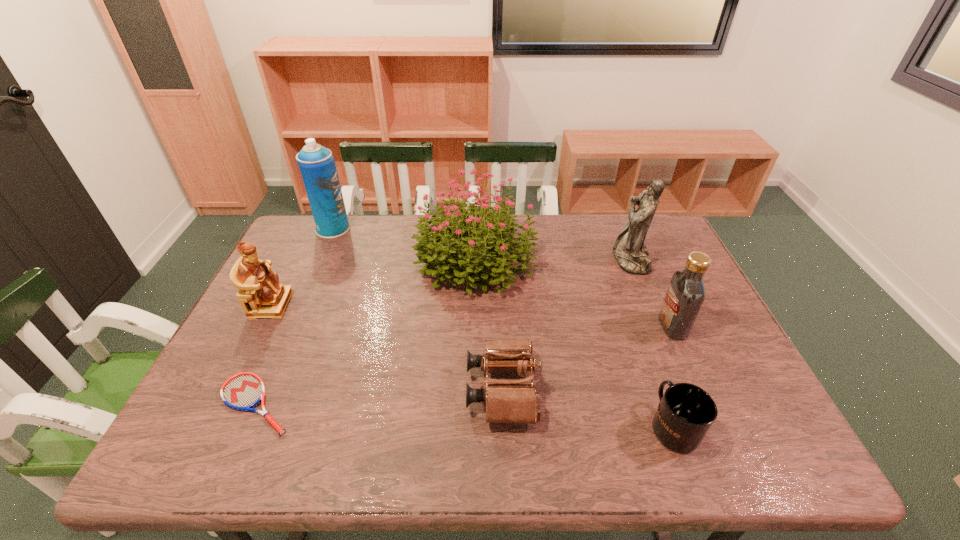
This screenshot has height=540, width=960. In order to click on aerosol can in this screenshot , I will do `click(317, 165)`.

This screenshot has width=960, height=540. What are the coordinates of `bouquet` in the screenshot? It's located at (489, 243).

Locate an element on the screen. The image size is (960, 540). the taller figurine is located at coordinates (629, 250).

Locate an element on the screen. The width and height of the screenshot is (960, 540). the right figurine is located at coordinates (629, 250).

At what (x,y) coordinates should I click in order to perform the action: click on vodka. Please return your answer as a coordinate pair (x, y). This screenshot has width=960, height=540. Looking at the image, I should click on (686, 293).

At what (x,y) coordinates should I click in order to perform the action: click on the left figurine. Please return your answer as a coordinate pair (x, y). Image resolution: width=960 pixels, height=540 pixels. Looking at the image, I should click on (260, 294).

Find the location of a particular element. The width and height of the screenshot is (960, 540). the shorter figurine is located at coordinates (260, 294).

The height and width of the screenshot is (540, 960). Find the location of `binoculars`. binoculars is located at coordinates (507, 401).

The image size is (960, 540). Identify the location of mug. (686, 412).

I want to click on tennis racket, so click(244, 391).